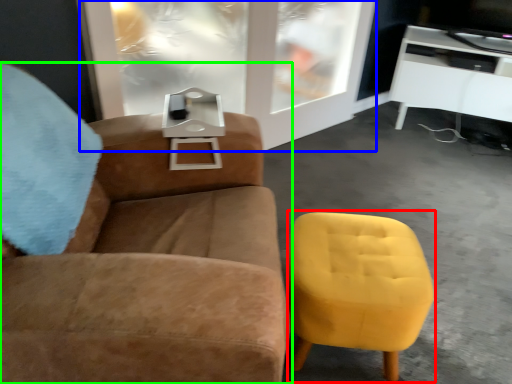
Question: Considering the real-world distances, which object is farthest from swivel chair (highlighted by a red box)? glass door (highlighted by a blue box) or chair (highlighted by a green box)?

Choices:
 (A) glass door
 (B) chair

Answer: (A)